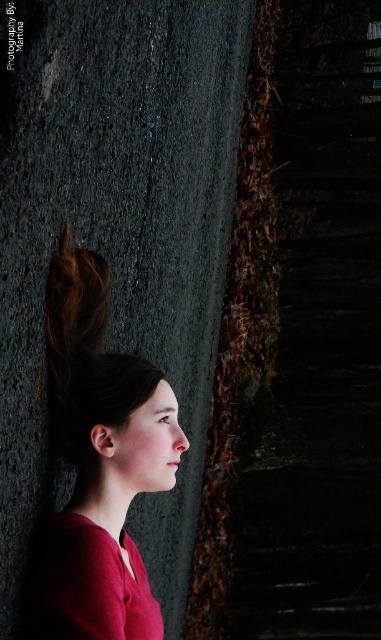
Question: Which point is closer to the camera?

Choices:
 (A) (94, 317)
 (B) (124, 378)

Answer: (B)

Question: Which of the following is the closest to the observer?

Choices:
 (A) (128, 586)
 (B) (163, 376)

Answer: (A)

Question: Does matte red shirt at left appear on the right side of dark brown silky hair at center?

Choices:
 (A) yes
 (B) no

Answer: (A)

Question: Can you confirm if matte red shirt at left is positioned above dark brown silky hair at center?

Choices:
 (A) yes
 (B) no

Answer: (B)

Question: Does matte red shirt at left appear over dark brown silky hair at center?

Choices:
 (A) yes
 (B) no

Answer: (B)